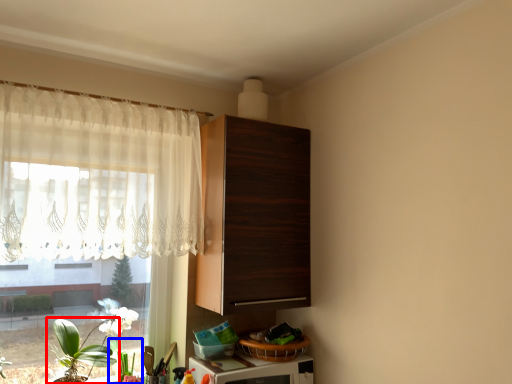
Question: Which object is closer to the camera taking this photo, houseplant (highlighted by a red box) or plant (highlighted by a blue box)?

Choices:
 (A) houseplant
 (B) plant

Answer: (A)